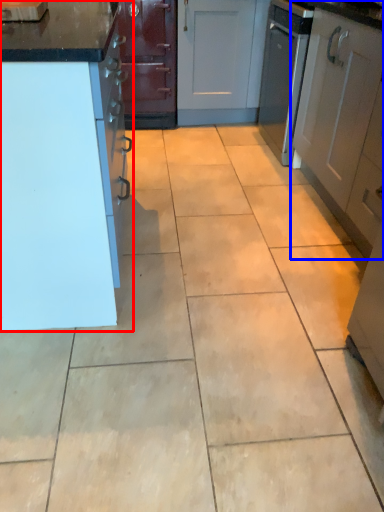
Question: Which object is further to the camera taking this photo, cabinetry (highlighted by a red box) or cabinetry (highlighted by a blue box)?

Choices:
 (A) cabinetry
 (B) cabinetry

Answer: (B)